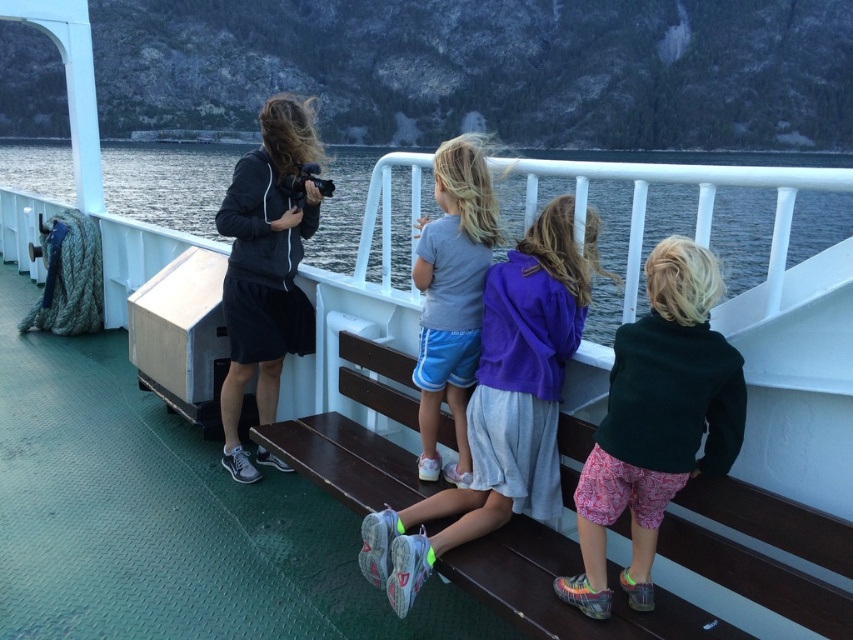
Question: Does matte black jacket at center appear over light gray cotton shirt at center?

Choices:
 (A) no
 (B) yes

Answer: (B)

Question: Does clear water at upper left appear on the left side of gray fabric shorts at center?

Choices:
 (A) yes
 (B) no

Answer: (A)

Question: Considering the real-world distances, which object is farthest from the clear water at upper left?

Choices:
 (A) gray fabric shorts at center
 (B) matte black jacket at center
 (C) light gray cotton shirt at center

Answer: (C)

Question: Which is nearer to the light gray cotton shirt at center?

Choices:
 (A) clear water at upper left
 (B) gray fabric shorts at center

Answer: (B)

Question: Where is dark green fleece jacket at center located in relation to light gray cotton shirt at center in the image?

Choices:
 (A) left
 (B) right

Answer: (B)

Question: Which object is the farthest from the matte black jacket at center?

Choices:
 (A) clear water at upper left
 (B) dark green fleece jacket at center
 (C) gray fabric shorts at center
 (D) light gray cotton shirt at center

Answer: (A)